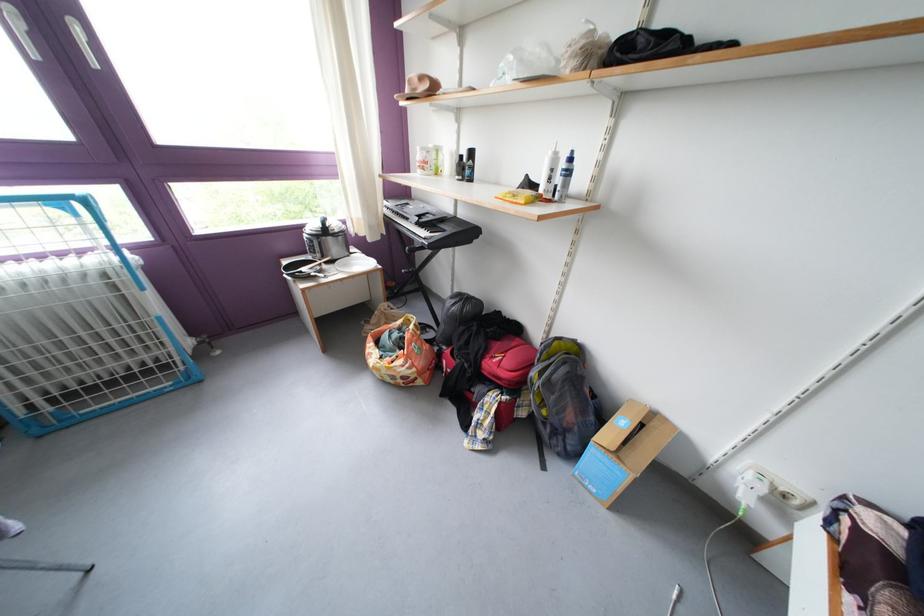
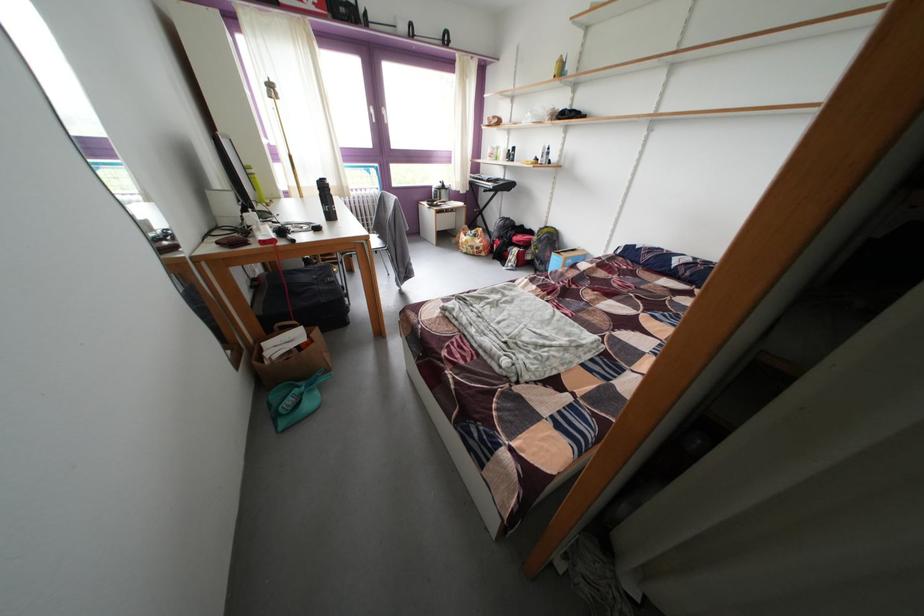
Question: What movement of the cameraman would produce the second image?

Choices:
 (A) Left
 (B) Right
 (C) Forward
 (D) Backward

Answer: (D)